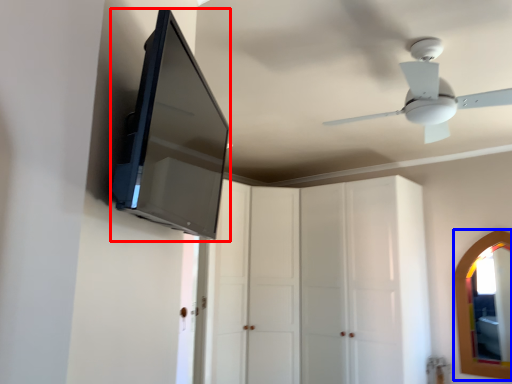
Question: Which object appears closest to the camera in this image, medicine cabinet (highlighted by a red box) or mirror (highlighted by a blue box)?

Choices:
 (A) medicine cabinet
 (B) mirror

Answer: (A)